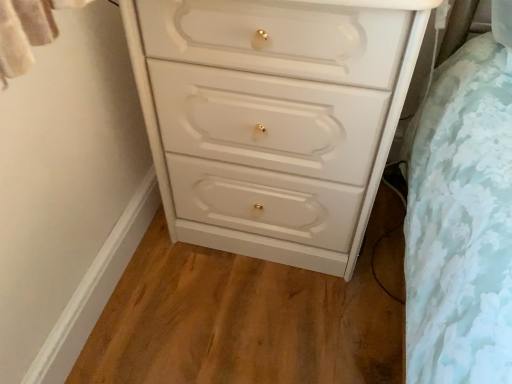
This screenshot has height=384, width=512. Find the location of `free space in front of white glossy chest of drawers at center`. free space in front of white glossy chest of drawers at center is located at coordinates (256, 319).